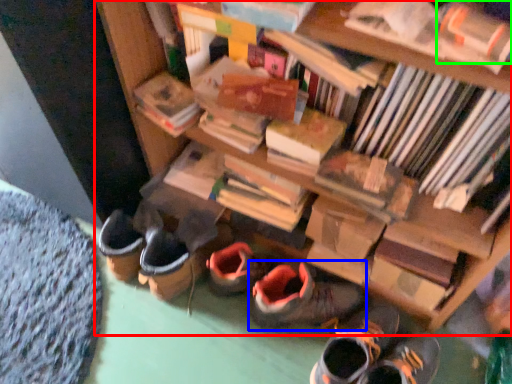
Question: Which object is positioned farthest from bookcase (highlighted by a red box)? Select from footwear (highlighted by a blue box) and book (highlighted by a green box).

Choices:
 (A) footwear
 (B) book

Answer: (B)